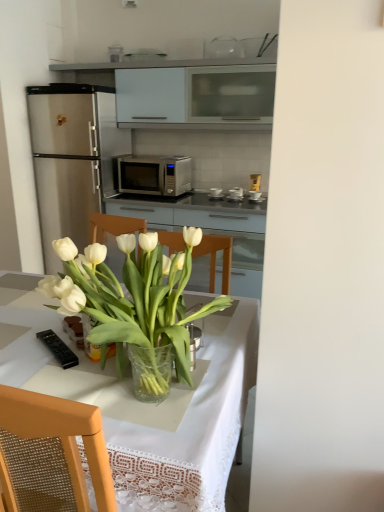
At what (x,y) coordinates should I click in order to perform the action: click on vacant area that is in front of black plastic remote control at lower left, which ranks as the first appliance in front-to-back order. Please return your answer as a coordinate pair (x, y). This screenshot has height=512, width=384. Looking at the image, I should click on (50, 373).